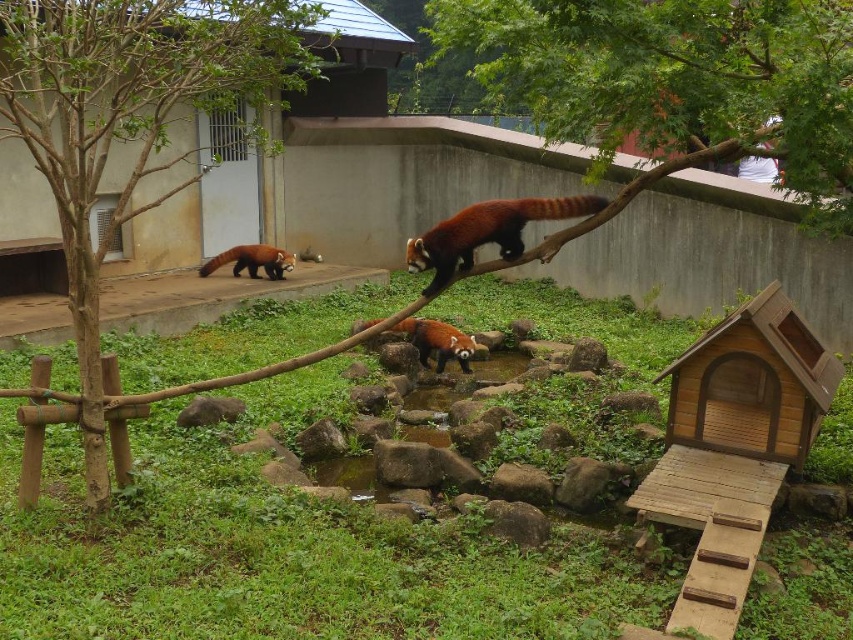
Is fuzzy reddish-brown animal at center positioned before brown furry animal at center?

That is True.

From the picture: Does fuzzy reddish-brown animal at center have a greater width compared to brown furry animal at center?

Indeed, fuzzy reddish-brown animal at center has a greater width compared to brown furry animal at center.

Describe the element at coordinates (437, 340) in the screenshot. Image resolution: width=853 pixels, height=640 pixels. I see `fuzzy reddish-brown animal at center` at that location.

Identify the location of fuzzy reddish-brown animal at center. (437, 340).

Is green leafy tree at upper center closer to the viewer compared to fuzzy reddish-brown animal at center?

Yes, green leafy tree at upper center is closer to the viewer.

Between point (809, 58) and point (426, 340), which one is positioned in front?

Point (809, 58) is in front.

At what (x,y) coordinates should I click in order to perform the action: click on green leafy tree at upper center. Please return your answer as a coordinate pair (x, y). The width and height of the screenshot is (853, 640). Looking at the image, I should click on (674, 77).

Does green leafy tree at left come in front of fluffy reddish-brown panda at upper center?

Yes, green leafy tree at left is closer to the viewer.

Which is behind, point (80, 141) or point (486, 236)?

The point (486, 236) is behind.

Describe the element at coordinates (128, 120) in the screenshot. I see `green leafy tree at left` at that location.

At what (x,y) coordinates should I click in order to perform the action: click on green leafy tree at left. Please return your answer as a coordinate pair (x, y). Looking at the image, I should click on (128, 120).